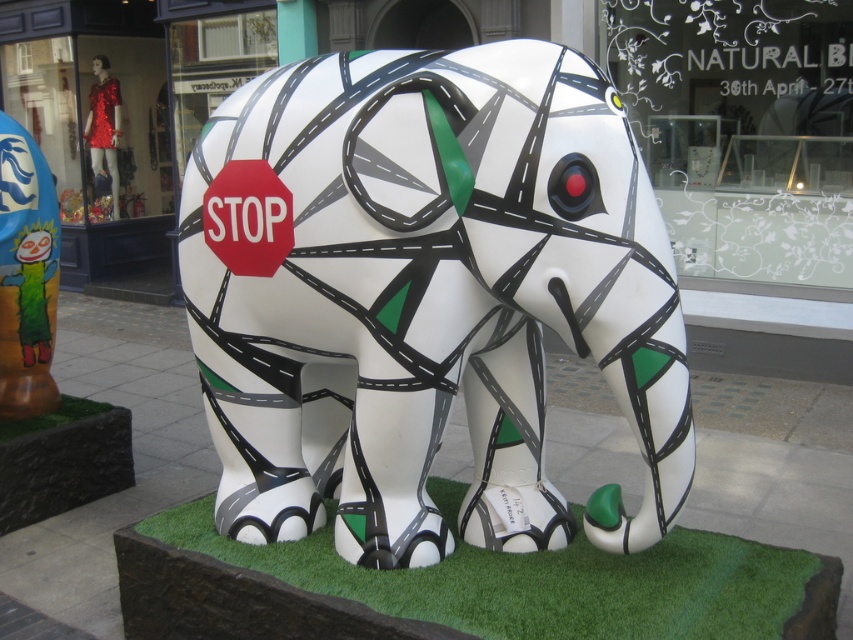
Question: Does red plastic stop sign at center appear on the right side of green artificial turf at lower left?

Choices:
 (A) yes
 (B) no

Answer: (A)

Question: Is transparent glass at upper center closer to the viewer compared to green artificial turf at lower center?

Choices:
 (A) yes
 (B) no

Answer: (B)

Question: Which is farther from the green artificial turf at lower left?

Choices:
 (A) green artificial turf at lower center
 (B) white glossy elephant at center
 (C) matte orange cactus at left
 (D) transparent glass at upper center

Answer: (D)

Question: Estimate the real-world distances between objects in this image. Which object is closer to the green artificial turf at lower left?

Choices:
 (A) transparent glass at upper center
 (B) white glossy elephant at center
 (C) red plastic stop sign at center
 (D) matte orange cactus at left

Answer: (D)

Question: Among these objects, which one is farthest from the camera?

Choices:
 (A) white glossy elephant at center
 (B) red plastic stop sign at center

Answer: (B)

Question: Is white glossy elephant at center below matte orange cactus at left?

Choices:
 (A) no
 (B) yes

Answer: (B)